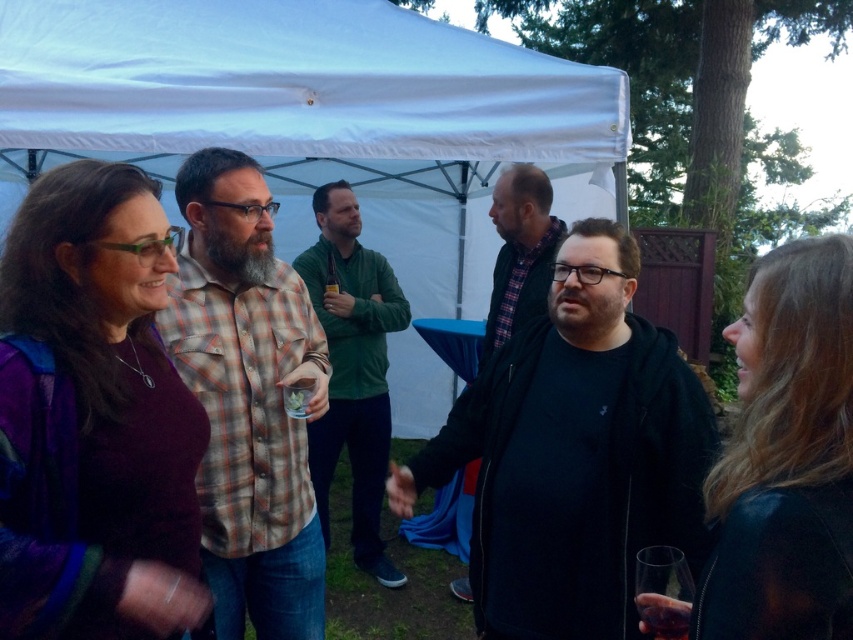
Question: Which object is farther from the camera taking this photo?

Choices:
 (A) plaid shirt at center
 (B) black matte jacket at center

Answer: (A)

Question: Which point is farther from the camera taking this photo?

Choices:
 (A) (397, 468)
 (B) (527, 276)
 (C) (369, 470)
 (D) (206, 284)

Answer: (C)

Question: Which point is farther to the camera?

Choices:
 (A) (459, 589)
 (B) (331, 285)
 (C) (328, 200)

Answer: (C)

Question: Is plaid shirt at center below translucent glass at center?

Choices:
 (A) yes
 (B) no

Answer: (A)

Question: In this image, where is black matte jacket at center located relative to clear plastic cup at center?

Choices:
 (A) above
 (B) below

Answer: (B)

Question: Does black matte jacket at center appear on the left side of dark gray hoodie at center?

Choices:
 (A) yes
 (B) no

Answer: (A)